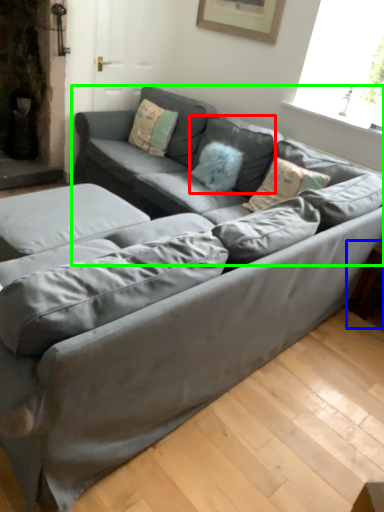
Question: Which is farther away from pillow (highlighted by a red box)? side table (highlighted by a blue box) or couch (highlighted by a green box)?

Choices:
 (A) side table
 (B) couch

Answer: (A)